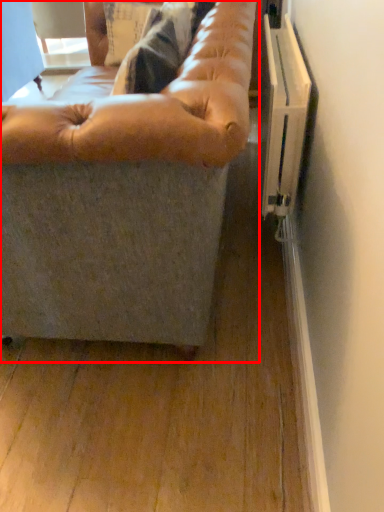
Question: Where is studio couch (annotated by the red box) located in relation to bean bag chair in the image?

Choices:
 (A) right
 (B) left

Answer: (B)